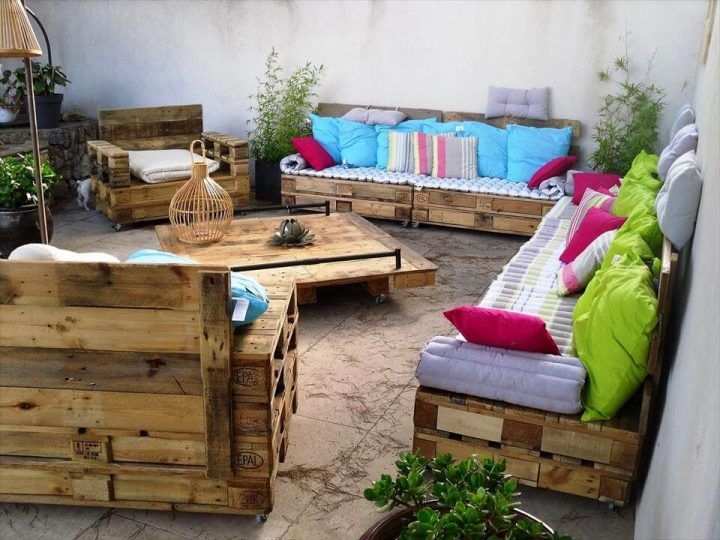
The height and width of the screenshot is (540, 720). In order to click on flower pot in this screenshot , I will do `click(261, 168)`, `click(538, 519)`, `click(30, 222)`, `click(45, 117)`.